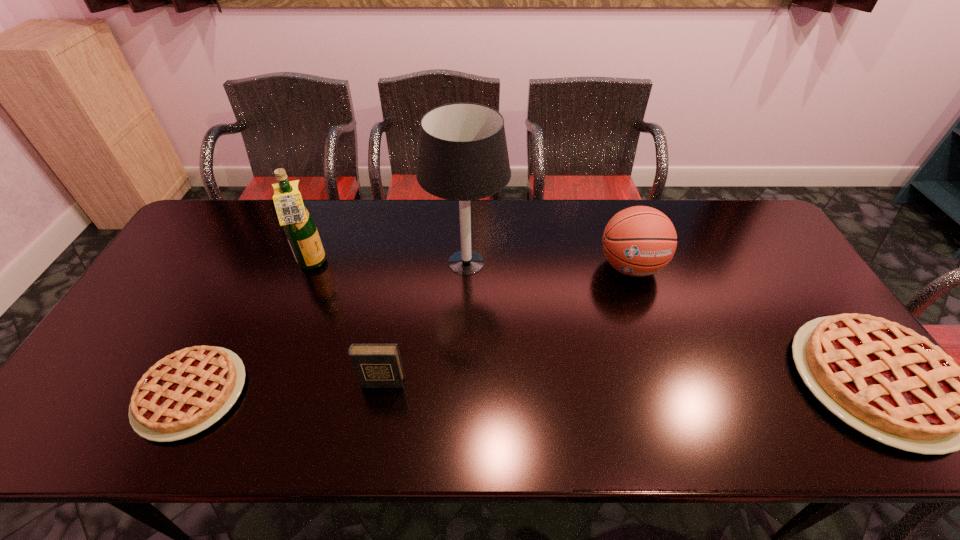
What are the coordinates of `location for an additional pie to make spacing equal` in the screenshot? It's located at (537, 387).